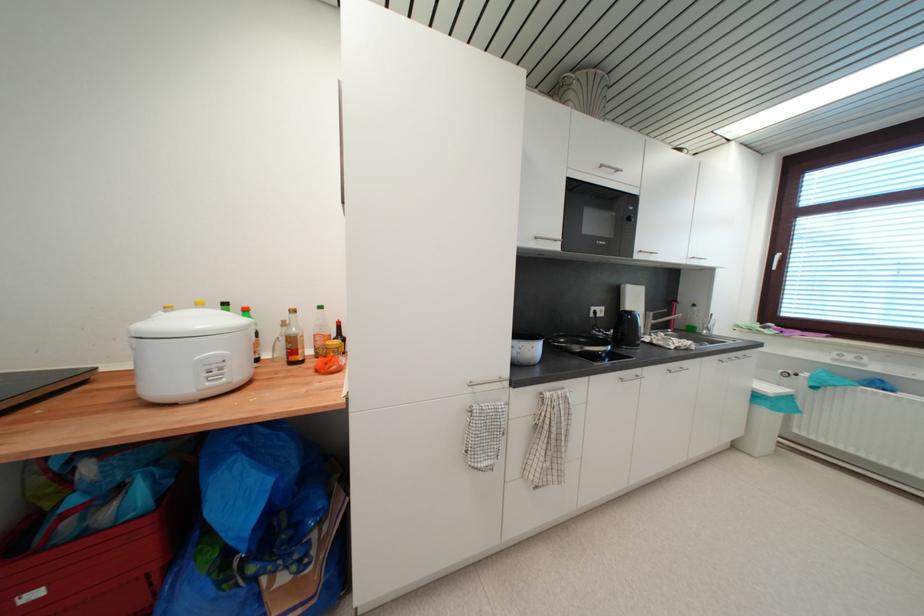
The image size is (924, 616). What do you see at coordinates (775, 261) in the screenshot? I see `the white window handle` at bounding box center [775, 261].